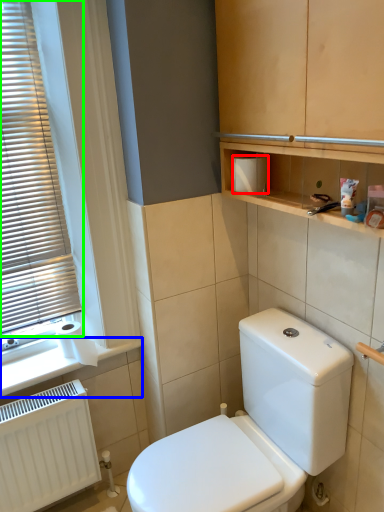
Question: Which object is positioned closest to toiletry box (highlighted by a red box)? Select from window sill (highlighted by a blue box) and window blind (highlighted by a green box).

Choices:
 (A) window sill
 (B) window blind

Answer: (B)